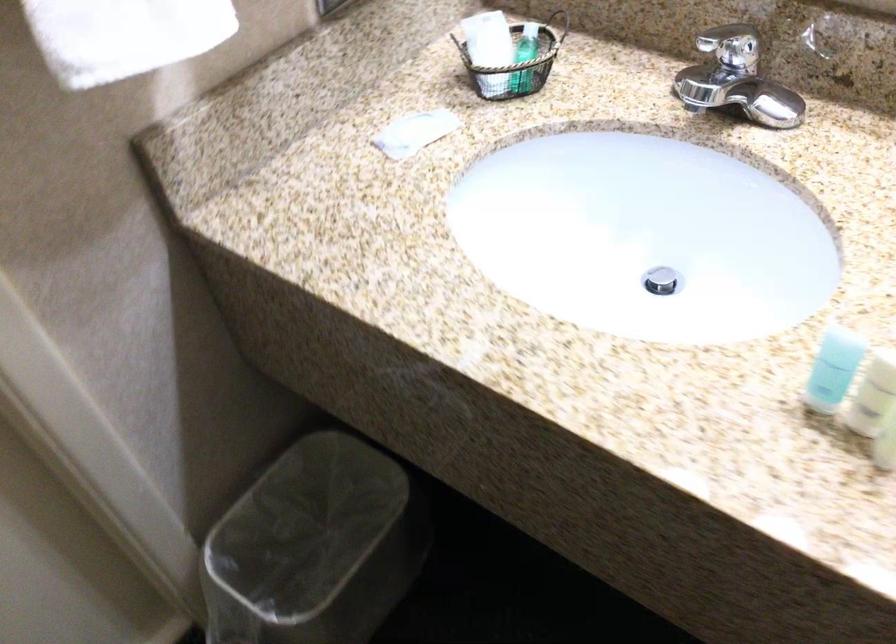
You are a GUI agent. You are given a task and a screenshot of the screen. Output one action in this format:
    pyautogui.click(x=<x>, y=<y>)
    Task: Click on the small white bottle
    
    Given the screenshot: What is the action you would take?
    pyautogui.click(x=873, y=395)